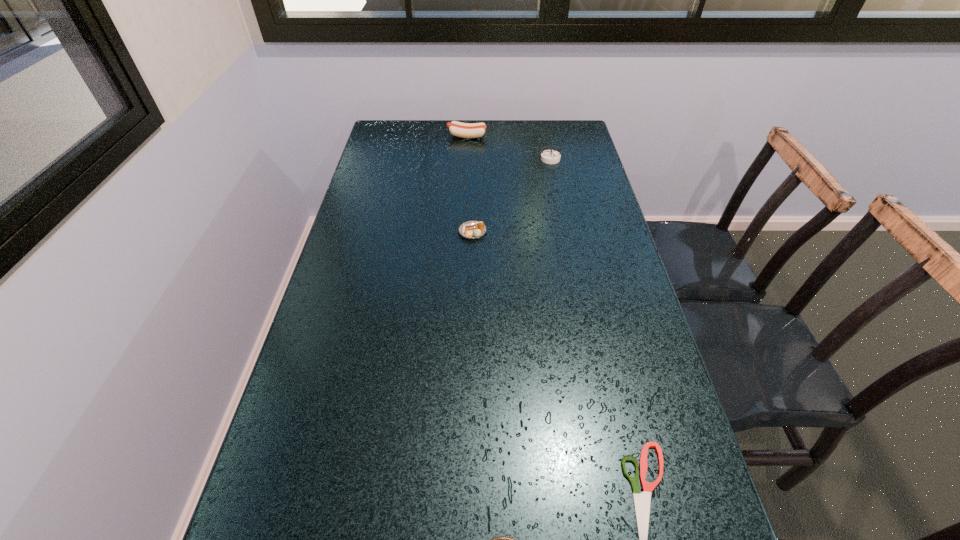
Where is `free space at the far edge of the desktop`? free space at the far edge of the desktop is located at coordinates (447, 152).

The image size is (960, 540). What are the coordinates of `free region at the left edge` in the screenshot? It's located at (405, 184).

Identify the location of blank area at the right edge. (622, 306).

Locate an element on the screen. The height and width of the screenshot is (540, 960). vacant point at the far left corner is located at coordinates (383, 138).

Find the location of a particular element. The image size is (960, 540). free space at the far right corner of the desktop is located at coordinates (578, 149).

Locate an element on the screen. vacant space that is in between the third farthest object and the farthest object is located at coordinates (469, 184).

Identify the location of unoccupied area between the farthest object and the right compass. (508, 147).

You are a GUI agent. You are given a task and a screenshot of the screen. Output one action in this format:
    pyautogui.click(x=<x>, y=<y>)
    Task: Click on the free point between the second farthest object and the pastry
    This screenshot has width=960, height=540.
    Given the screenshot: What is the action you would take?
    pyautogui.click(x=512, y=195)

This screenshot has height=540, width=960. What are the coordinates of `free spot between the pastry and the sausage` in the screenshot? It's located at (469, 184).

Where is `vacant space in between the taller compass and the third nearest object`? vacant space in between the taller compass and the third nearest object is located at coordinates (512, 195).